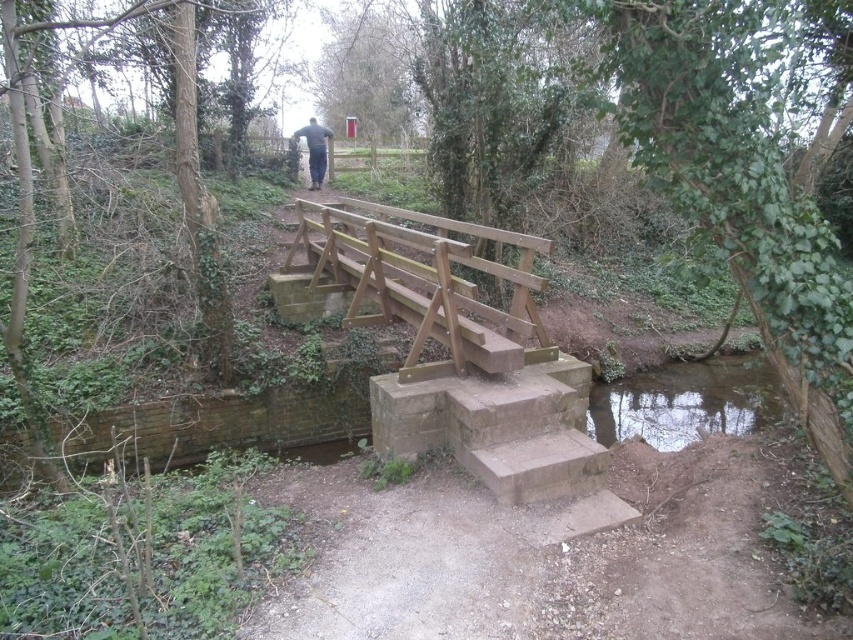
You are standing on the natural wood bridge at center and want to see the clear glassy water at lower right. In which direction should you look?

You should look to the right because the natural wood bridge at center is to the left of clear glassy water at lower right.

You are standing at the entrance of the bridge and want to cross to the other side. Where exactly is the natural wood bridge at center located in this scene?

The natural wood bridge at center is located at point (422, 284).

In the scene shown: You are standing on the rustic wooden bridge and notice the clear glassy water at lower right and dark blue jeans at center. Which object is closer to the ground?

The clear glassy water at lower right is below the dark blue jeans at center, so it is closer to the ground.